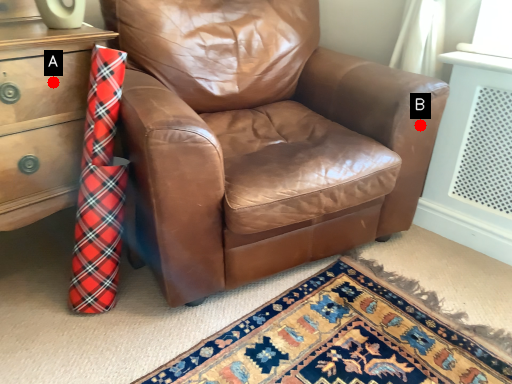
Question: Two points are circled on the image, labeled by A and B beside each circle. Which point is closer to the camera?

Choices:
 (A) A is closer
 (B) B is closer

Answer: (A)